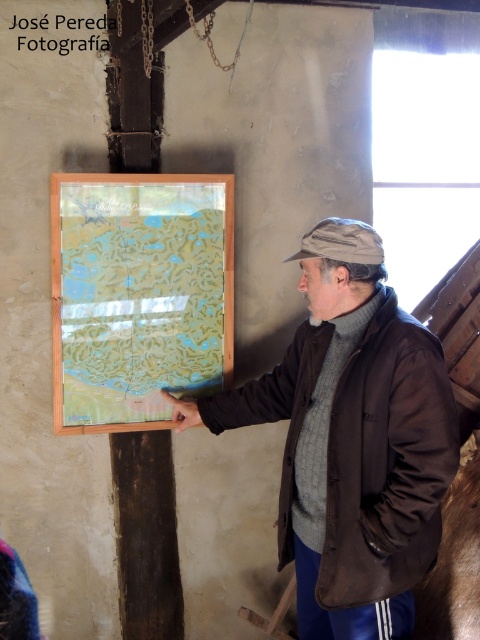
Question: Can you confirm if matte brown jacket at center is bigger than translucent paper map at center?

Choices:
 (A) yes
 (B) no

Answer: (A)

Question: Is matte brown jacket at center positioned behind translucent paper map at center?

Choices:
 (A) yes
 (B) no

Answer: (B)

Question: Which of the following is the farthest from the observer?

Choices:
 (A) translucent paper map at center
 (B) matte brown jacket at center

Answer: (A)

Question: Does matte brown jacket at center have a greater width compared to translucent paper map at center?

Choices:
 (A) yes
 (B) no

Answer: (A)

Question: Among these points, which one is farthest from the camera?

Choices:
 (A) (337, 240)
 (B) (208, 237)

Answer: (B)